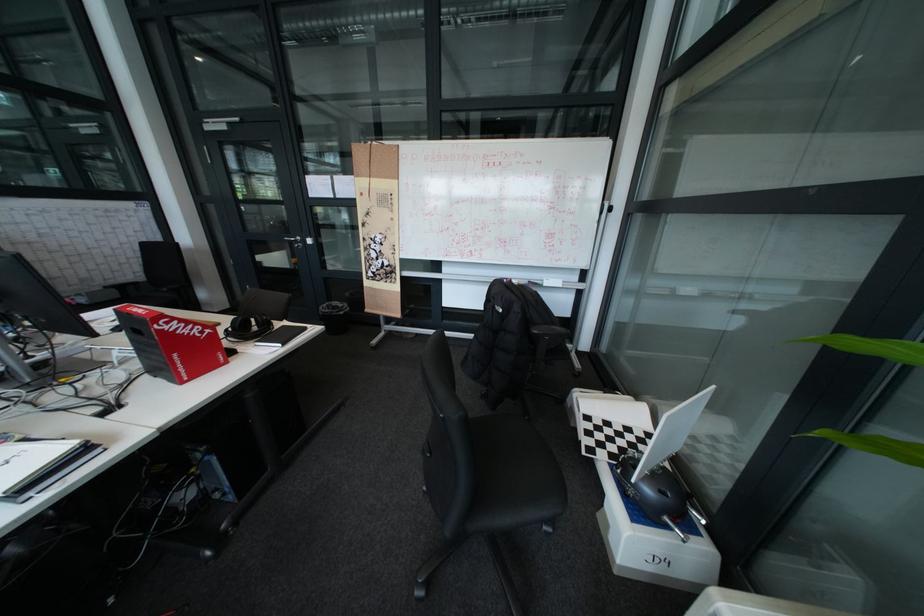
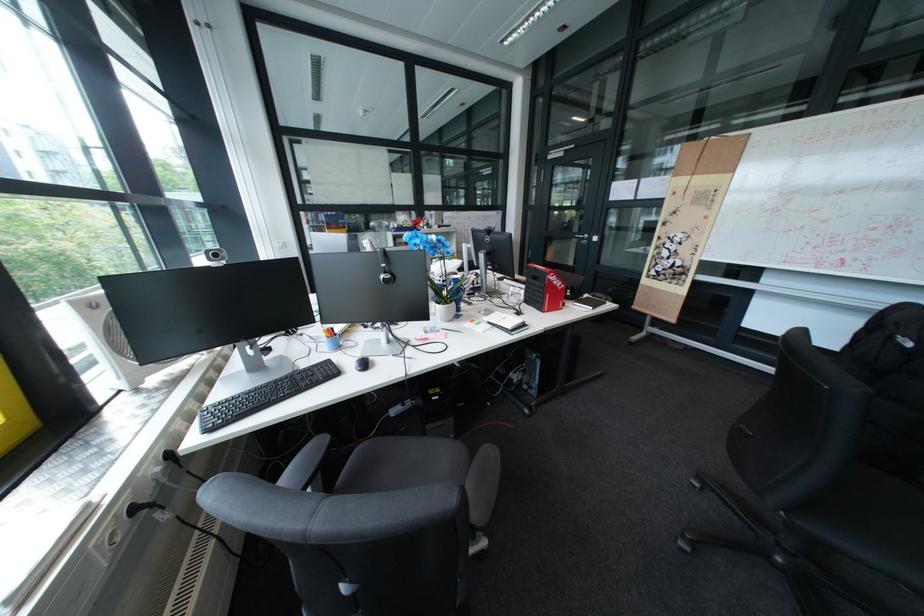
Question: How did the camera likely rotate?

Choices:
 (A) Left
 (B) Right
 (C) Up
 (D) Down

Answer: (A)